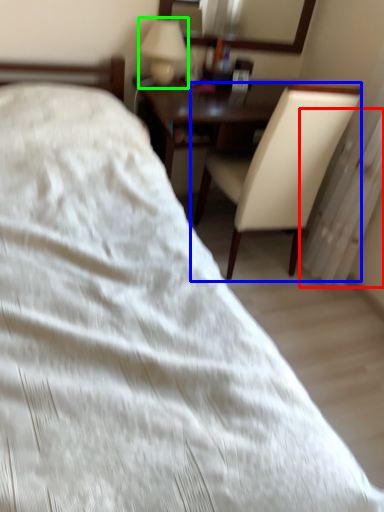
Question: Considering the real-world distances, which object is closest to radiator (highlighted by a red box)? chair (highlighted by a blue box) or table lamp (highlighted by a green box).

Choices:
 (A) chair
 (B) table lamp

Answer: (A)